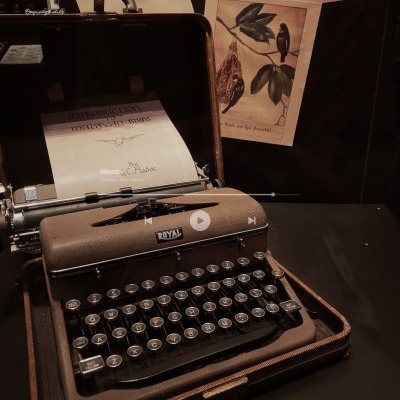
Find the location of a particular element. w key on the typewriter is located at coordinates click(113, 315).